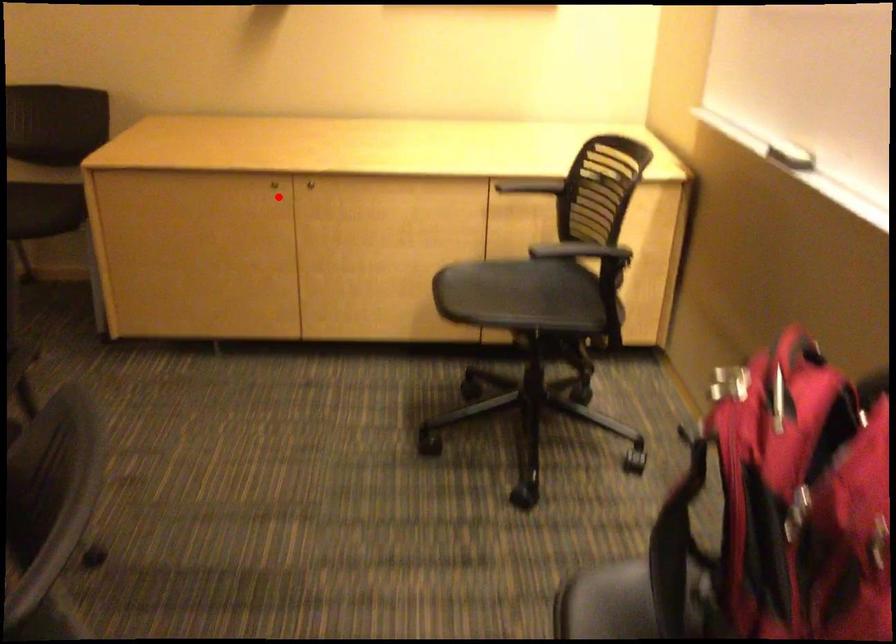
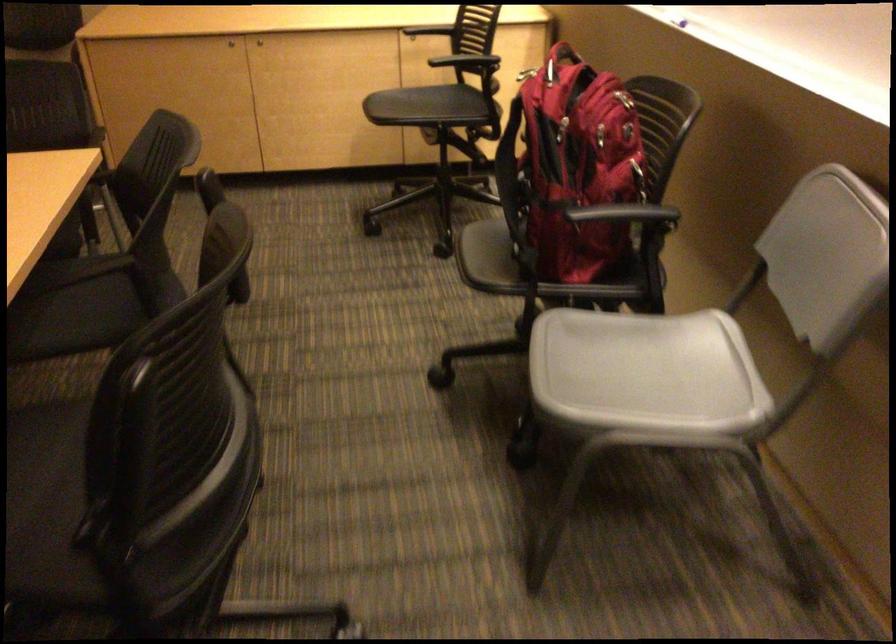
The point at the highlighted location is marked in the first image. Where is the corresponding point in the second image?

(230, 44)